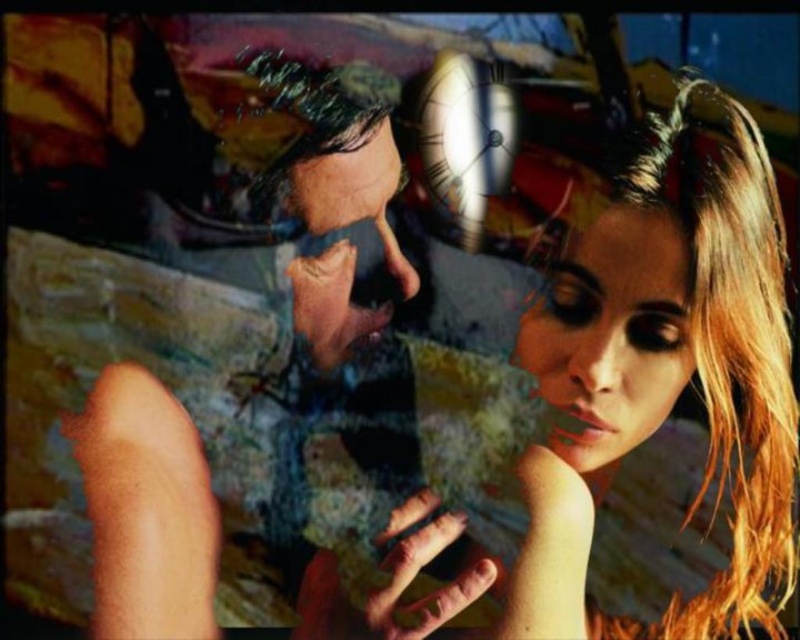
Does smooth skin face at center appear on the right side of smooth skin face at upper center?

Indeed, smooth skin face at center is positioned on the right side of smooth skin face at upper center.

Is smooth skin face at center to the left of smooth skin face at upper center from the viewer's perspective?

Incorrect, smooth skin face at center is not on the left side of smooth skin face at upper center.

What do you see at coordinates (612, 333) in the screenshot?
I see `smooth skin face at center` at bounding box center [612, 333].

The width and height of the screenshot is (800, 640). In order to click on smooth skin face at center in this screenshot , I will do tap(612, 333).